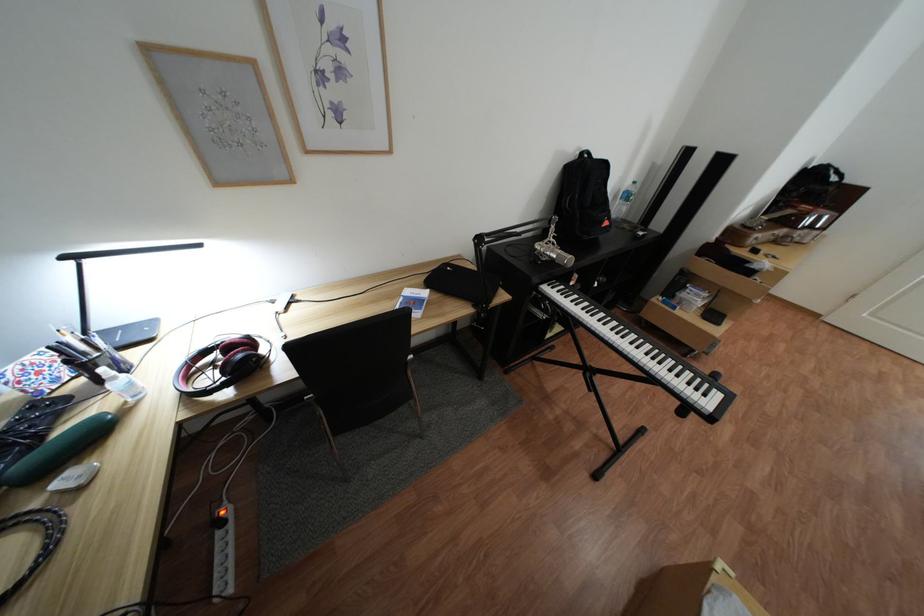
Identify the location of green elongated object. 58,450.